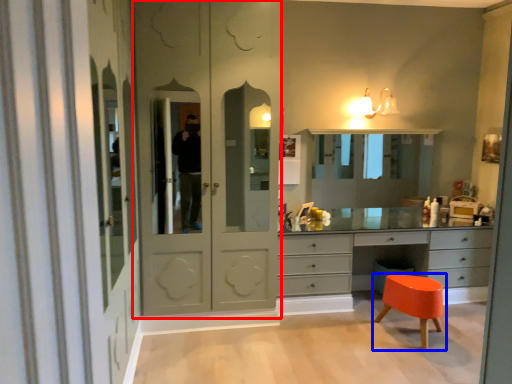
Question: Which object appears closest to the camera in this image, screen door (highlighted by a red box) or stool (highlighted by a blue box)?

Choices:
 (A) screen door
 (B) stool

Answer: (A)